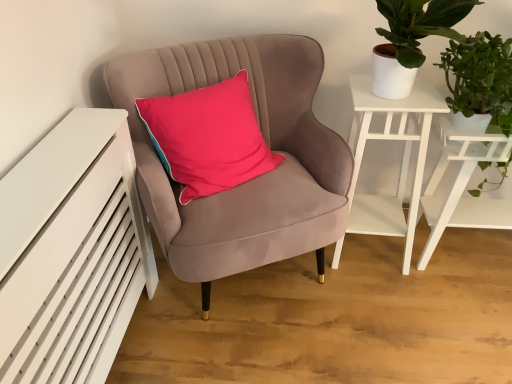
Question: Is velvet pink chair at center wider than white matte side table at upper right?

Choices:
 (A) no
 (B) yes

Answer: (B)

Question: From the image's perspective, would you say velvet pink chair at center is shown under white matte side table at upper right?

Choices:
 (A) no
 (B) yes

Answer: (A)

Question: From the image's perspective, does velvet pink chair at center appear higher than white matte side table at upper right?

Choices:
 (A) yes
 (B) no

Answer: (A)

Question: Is velvet pink chair at center positioned far away from white matte side table at upper right?

Choices:
 (A) no
 (B) yes

Answer: (A)

Question: Does velvet pink chair at center touch white matte side table at upper right?

Choices:
 (A) no
 (B) yes

Answer: (A)

Question: Considering the relative positions of green leafy plant at upper right and white matte table at right in the image provided, is green leafy plant at upper right to the left or to the right of white matte table at right?

Choices:
 (A) right
 (B) left

Answer: (B)

Question: Considering the positions of green leafy plant at upper right and white matte table at right in the image, is green leafy plant at upper right bigger or smaller than white matte table at right?

Choices:
 (A) big
 (B) small

Answer: (B)

Question: From the image's perspective, relative to white matte table at right, is green leafy plant at upper right above or below?

Choices:
 (A) above
 (B) below

Answer: (A)

Question: Does point (486, 72) appear closer or farther from the camera than point (483, 152)?

Choices:
 (A) closer
 (B) farther

Answer: (A)

Question: Relative to white matte side table at upper right, is velvet pink chair at center in front or behind?

Choices:
 (A) behind
 (B) front

Answer: (B)

Question: Considering the positions of velvet pink chair at center and white matte side table at upper right in the image, is velvet pink chair at center bigger or smaller than white matte side table at upper right?

Choices:
 (A) small
 (B) big

Answer: (B)

Question: Considering the positions of velvet pink chair at center and white matte side table at upper right in the image, is velvet pink chair at center wider or thinner than white matte side table at upper right?

Choices:
 (A) wide
 (B) thin

Answer: (A)

Question: Is velvet pink chair at center taller or shorter than white matte side table at upper right?

Choices:
 (A) short
 (B) tall

Answer: (B)

Question: From a real-world perspective, is velvet pink chair at center above or below white matte table at right?

Choices:
 (A) above
 (B) below

Answer: (A)

Question: From their relative heights in the image, would you say velvet pink chair at center is taller or shorter than white matte table at right?

Choices:
 (A) tall
 (B) short

Answer: (A)